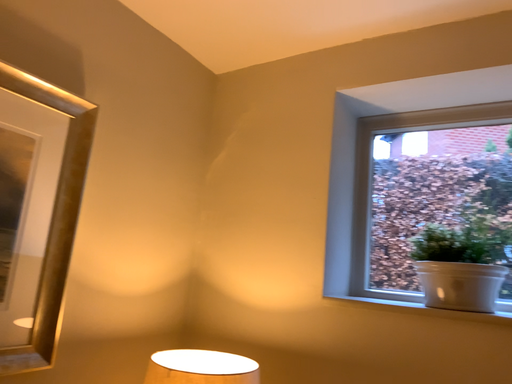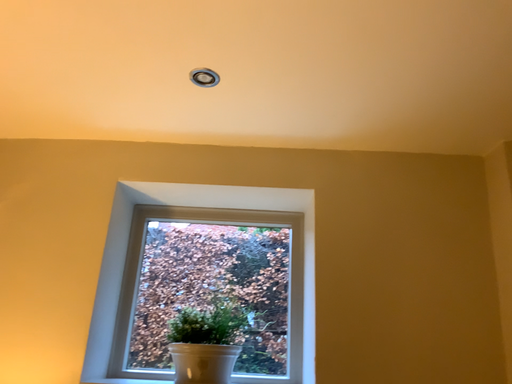
Question: How did the camera likely rotate when shooting the video?

Choices:
 (A) rotated upward
 (B) rotated downward

Answer: (A)